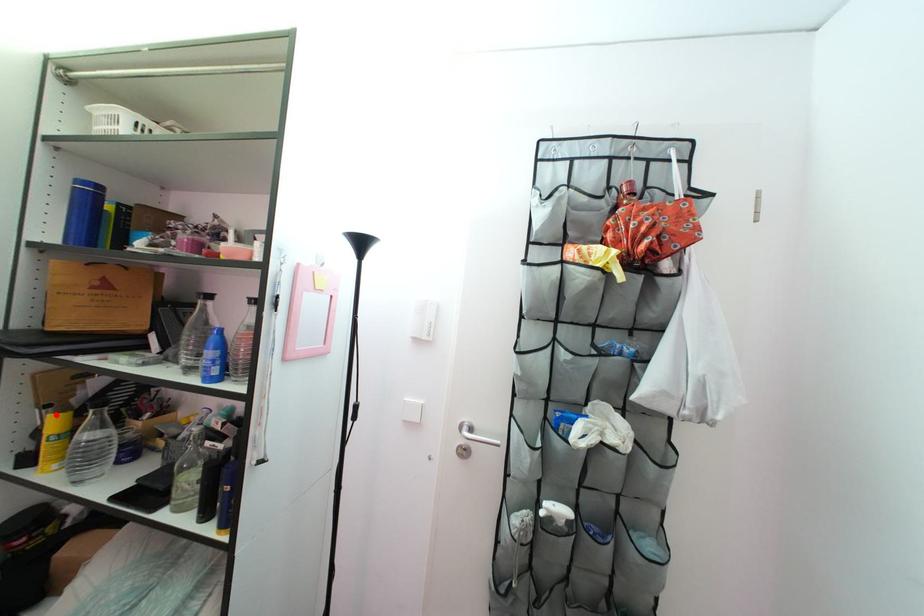
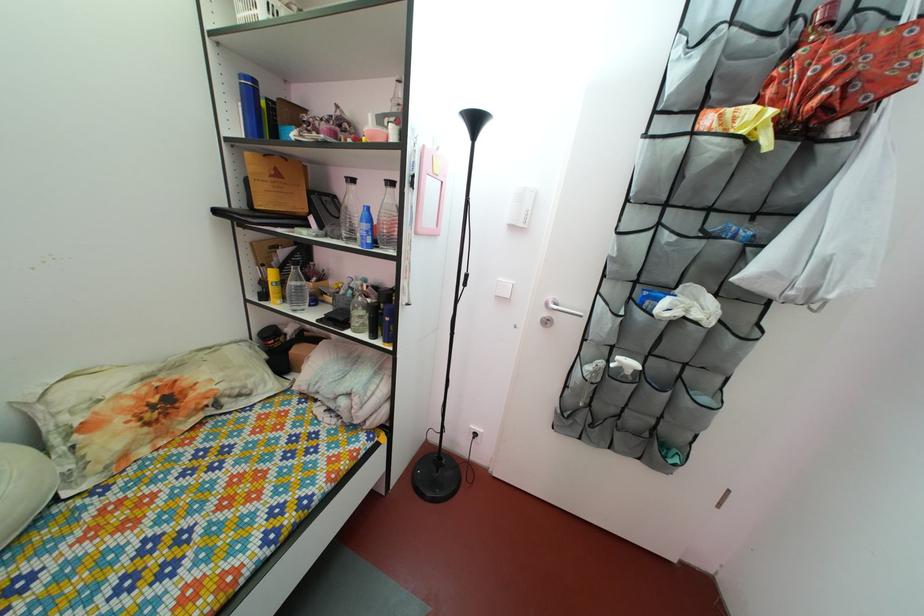
Locate, in the second image, the point that corresponds to the highlighted location in the first image.

(272, 274)